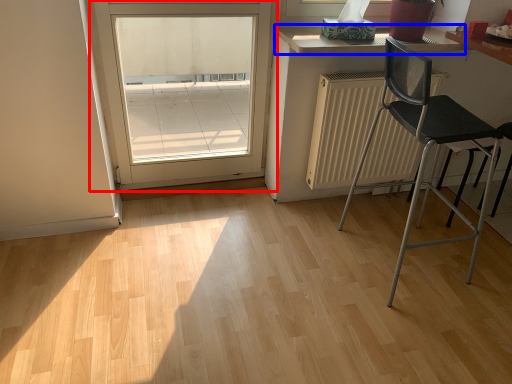
Question: Which point is further to the camera, door (highlighted by a red box) or counter top (highlighted by a blue box)?

Choices:
 (A) door
 (B) counter top

Answer: (B)